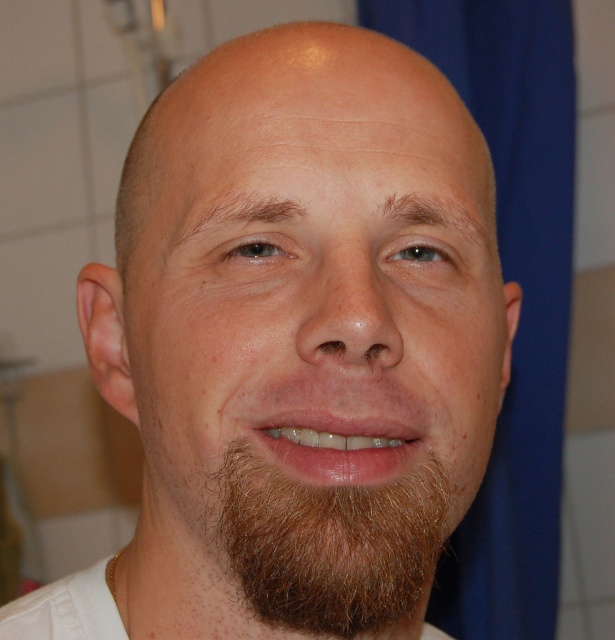
Question: Can you confirm if brown matte beard at center is positioned above brown fuzzy beard at lower center?

Choices:
 (A) yes
 (B) no

Answer: (A)

Question: Which point is farther to the camera?

Choices:
 (A) brown matte beard at center
 (B) brown fuzzy beard at lower center

Answer: (B)

Question: Which of the following is the closest to the observer?

Choices:
 (A) (375, 502)
 (B) (378, 321)

Answer: (B)

Question: From the image, what is the correct spatial relationship of brown matte beard at center in relation to brown fuzzy beard at lower center?

Choices:
 (A) below
 (B) above

Answer: (B)

Question: Can you confirm if brown matte beard at center is positioned to the left of brown fuzzy beard at lower center?

Choices:
 (A) yes
 (B) no

Answer: (A)

Question: Which object is closer to the camera taking this photo?

Choices:
 (A) brown matte beard at center
 (B) brown fuzzy beard at lower center

Answer: (A)